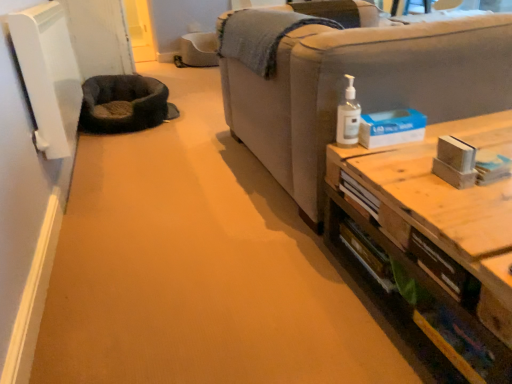
Question: From the image's perspective, is clear plastic pump bottle at upper right on top of dark gray plush cat bed at left?

Choices:
 (A) yes
 (B) no

Answer: (B)

Question: Can you confirm if clear plastic pump bottle at upper right is wider than dark gray plush cat bed at left?

Choices:
 (A) yes
 (B) no

Answer: (B)

Question: Is dark gray plush cat bed at left at the back of clear plastic pump bottle at upper right?

Choices:
 (A) yes
 (B) no

Answer: (B)

Question: Does clear plastic pump bottle at upper right have a lesser width compared to dark gray plush cat bed at left?

Choices:
 (A) no
 (B) yes

Answer: (B)

Question: Would you say clear plastic pump bottle at upper right contains dark gray plush cat bed at left?

Choices:
 (A) yes
 (B) no

Answer: (B)

Question: Is the depth of clear plastic pump bottle at upper right greater than that of dark gray plush cat bed at left?

Choices:
 (A) no
 (B) yes

Answer: (A)

Question: From the image's perspective, is light gray fabric couch at right above clear plastic pump bottle at upper right?

Choices:
 (A) yes
 (B) no

Answer: (A)

Question: Is light gray fabric couch at right facing away from clear plastic pump bottle at upper right?

Choices:
 (A) yes
 (B) no

Answer: (B)

Question: From a real-world perspective, is light gray fabric couch at right located higher than clear plastic pump bottle at upper right?

Choices:
 (A) yes
 (B) no

Answer: (B)

Question: Is there a large distance between light gray fabric couch at right and clear plastic pump bottle at upper right?

Choices:
 (A) no
 (B) yes

Answer: (A)

Question: Is clear plastic pump bottle at upper right a part of light gray fabric couch at right?

Choices:
 (A) no
 (B) yes

Answer: (B)

Question: From a real-world perspective, is light gray fabric couch at right under clear plastic pump bottle at upper right?

Choices:
 (A) no
 (B) yes

Answer: (B)

Question: Does dark gray plush cat bed at left appear on the left side of wooden table at right?

Choices:
 (A) yes
 (B) no

Answer: (A)